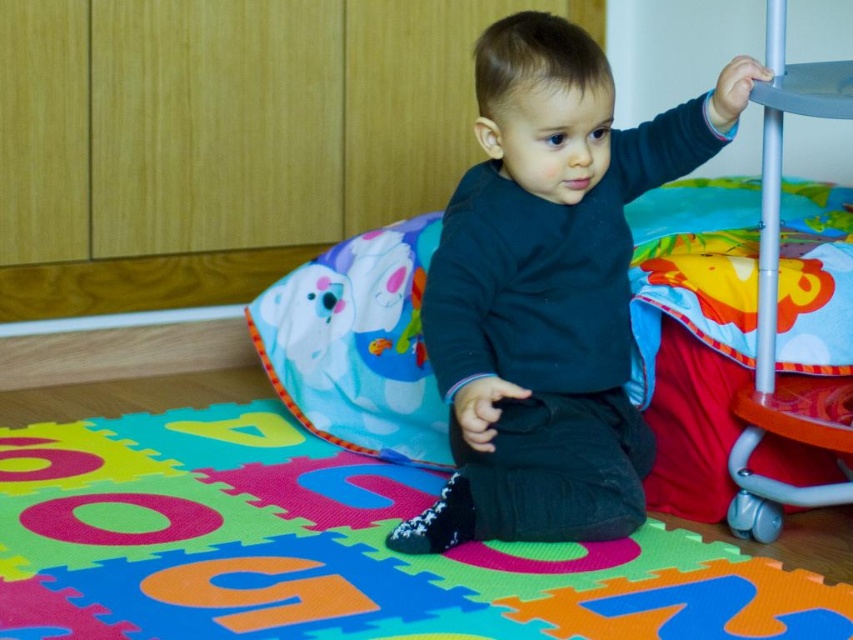
Question: Considering the relative positions of multicolored foam puzzle at center and matte black shirt at center in the image provided, where is multicolored foam puzzle at center located with respect to matte black shirt at center?

Choices:
 (A) left
 (B) right

Answer: (A)

Question: Which point is closer to the camera taking this photo?

Choices:
 (A) (474, 604)
 (B) (438, 256)

Answer: (A)

Question: Considering the relative positions of multicolored foam puzzle at center and matte black shirt at center in the image provided, where is multicolored foam puzzle at center located with respect to matte black shirt at center?

Choices:
 (A) left
 (B) right

Answer: (A)

Question: Does multicolored foam puzzle at center have a larger size compared to matte black shirt at center?

Choices:
 (A) yes
 (B) no

Answer: (A)